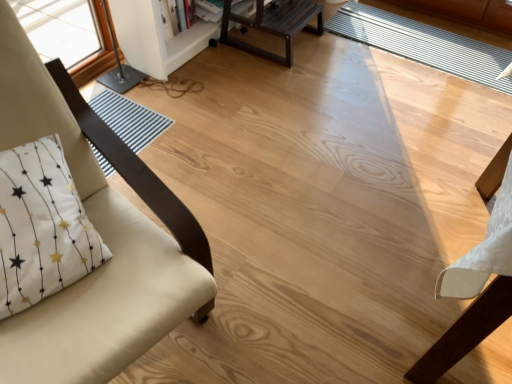
You are a GUI agent. You are given a task and a screenshot of the screen. Output one action in this format:
    pyautogui.click(x=<x>, y=<y>)
    Task: Click on the vacant area located to the right-hand side of white painted wood bookshelf at upper center
    
    Given the screenshot: What is the action you would take?
    pyautogui.click(x=312, y=68)